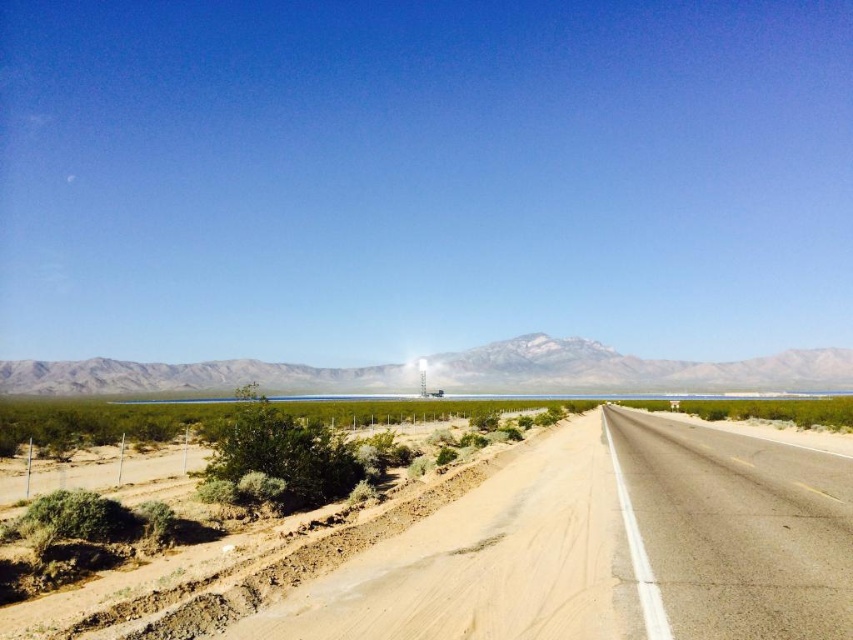
You are driving a truck that is 10 meters long. You need to turn around on the asphalt road at right. Can you do it in one try without hitting the green shrubbery at lower left?

The asphalt road at right is bigger than the green shrubbery at lower left. However, the exact dimensions of the road aren generated in the provided information, so it is uncertain if the 10 meter truck can turn around in one try without hitting the shrubbery. More information is needed about the road width and available space.

You are standing at the point marked as point (740, 529). What object is located at this point?

The asphalt road at right is located at point (740, 529).